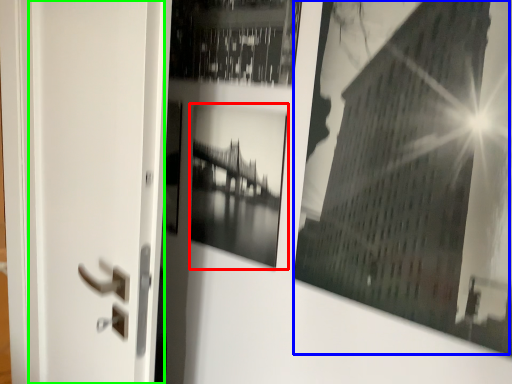
Question: Considering the real-world distances, which object is closest to picture frame (highlighted by a red box)? picture frame (highlighted by a blue box) or screen door (highlighted by a green box).

Choices:
 (A) picture frame
 (B) screen door

Answer: (A)